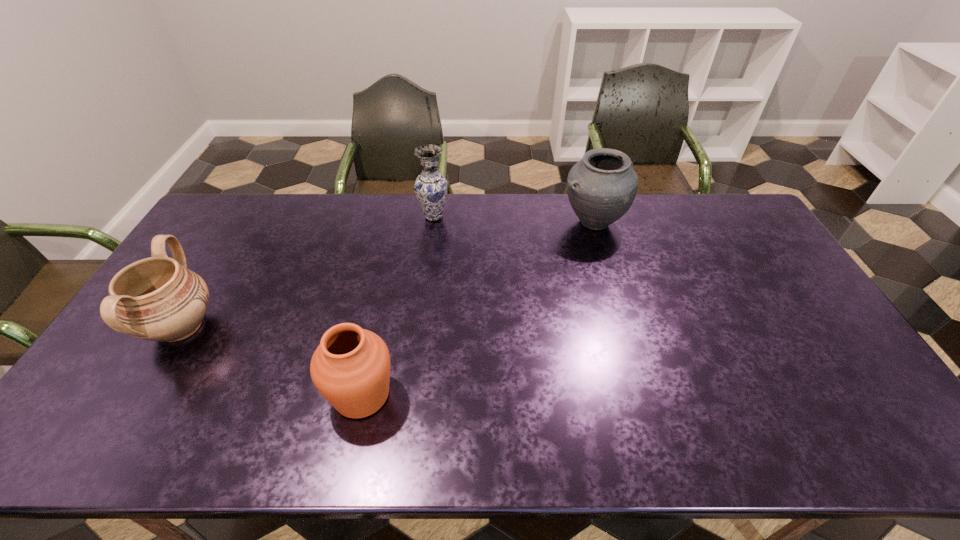
The width and height of the screenshot is (960, 540). Identify the location of free space between the second urn from left to right and the farthest urn. (477, 308).

Locate an element on the screen. free spot between the rightmost object and the leftmost object is located at coordinates (387, 275).

Find the location of `empty space between the leftmost urn and the rightmost urn`. empty space between the leftmost urn and the rightmost urn is located at coordinates (387, 275).

At what (x,y) coordinates should I click in order to perform the action: click on vacant space that's between the vase and the rightmost urn. Please return your answer as a coordinate pair (x, y). The image size is (960, 540). Looking at the image, I should click on (514, 220).

What are the coordinates of `vacant space that is in between the leftmost urn and the rightmost object` in the screenshot? It's located at (387, 275).

Locate an element on the screen. The width and height of the screenshot is (960, 540). free space between the vase and the leftmost urn is located at coordinates (307, 272).

In order to click on free space between the rightmost urn and the leftmost object in this screenshot , I will do `click(387, 275)`.

Image resolution: width=960 pixels, height=540 pixels. I want to click on object that can be found as the second closest to the vase, so click(x=351, y=367).

This screenshot has width=960, height=540. I want to click on object that is the second nearest to the rightmost object, so click(351, 367).

Where is `urn that stands as the second closest to the second urn from right to left`? Image resolution: width=960 pixels, height=540 pixels. urn that stands as the second closest to the second urn from right to left is located at coordinates (601, 187).